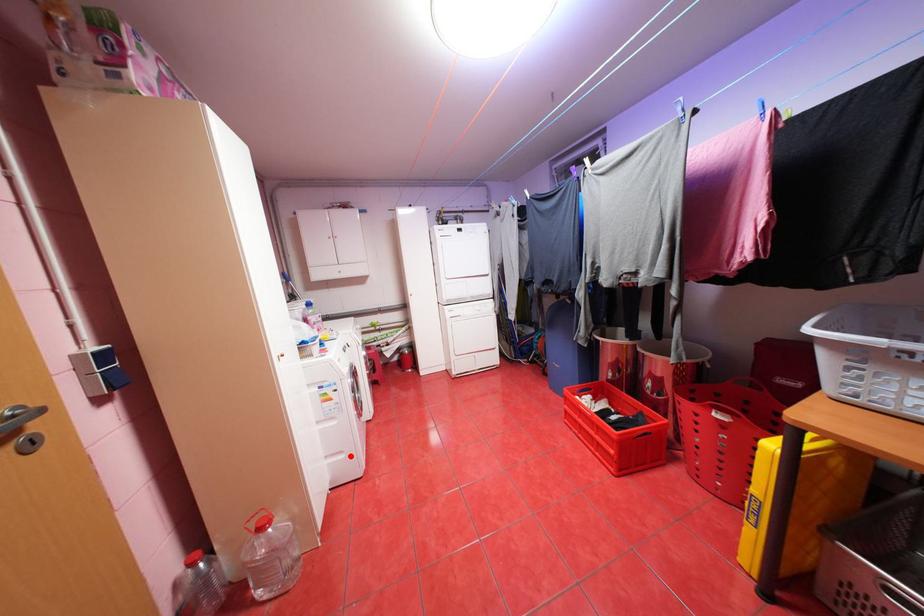
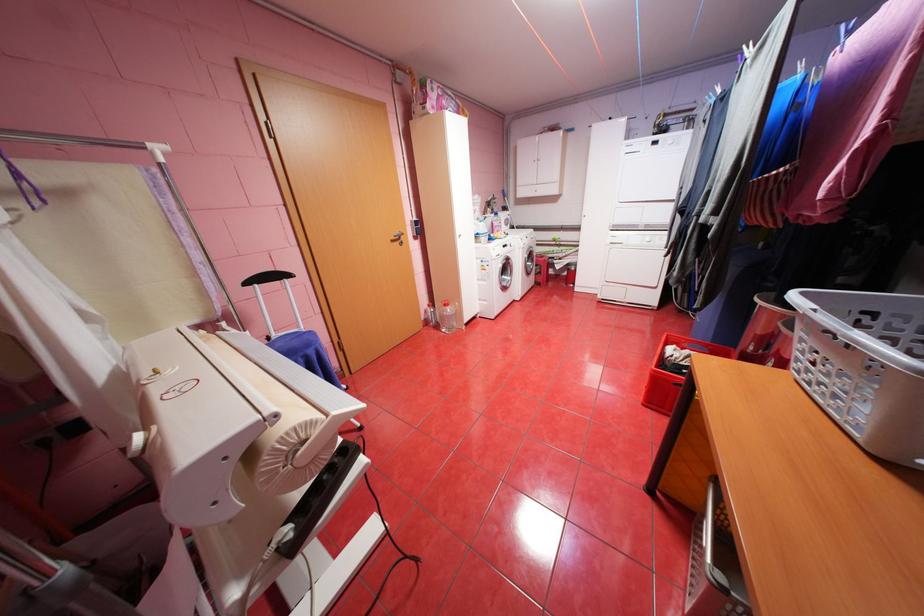
Question: A red point is marked in image1. In image2, is the corresponding 3D point closer to the camera or farther? Reply with the corresponding letter.

Choices:
 (A) The corresponding 3D point is closer.
 (B) The corresponding 3D point is farther.

Answer: (B)